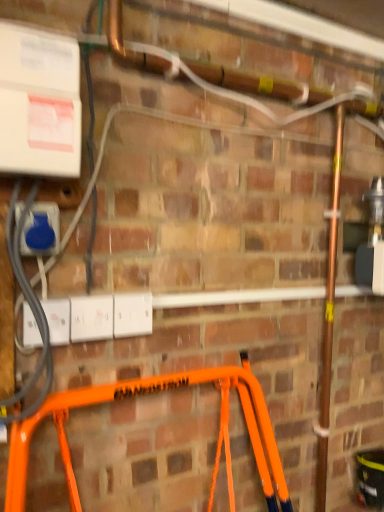
Consider the image. What is the approximate height of blue rubber plug at left?

The height of blue rubber plug at left is 3.75 inches.

Identify the location of blue rubber plug at left. The image size is (384, 512). (41, 230).

The image size is (384, 512). What do you see at coordinates (41, 230) in the screenshot?
I see `blue rubber plug at left` at bounding box center [41, 230].

What is the approximate width of blue rubber plug at left?

blue rubber plug at left is 2.54 inches in width.

Identify the location of blue rubber plug at left. Image resolution: width=384 pixels, height=512 pixels. (41, 230).